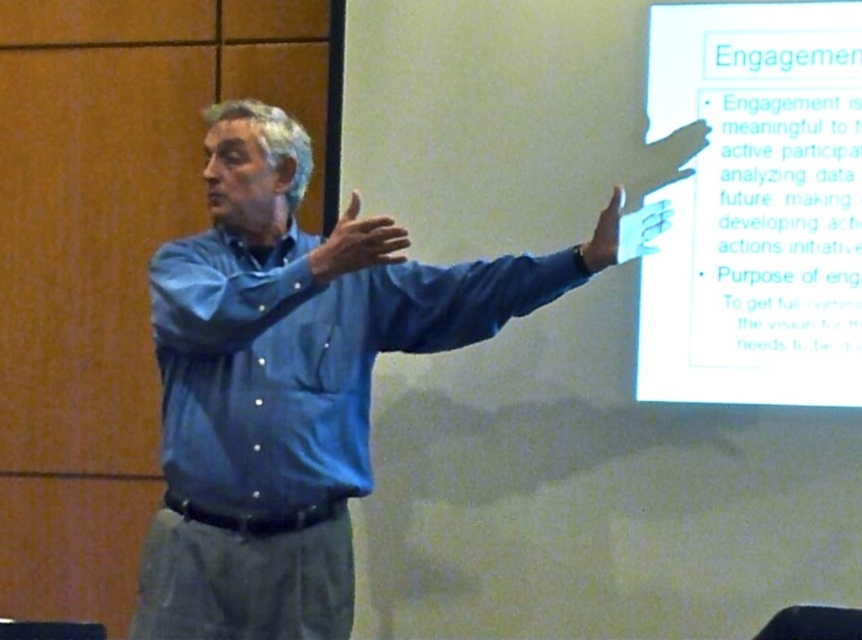
Question: Which point appears closest to the camera in this image?

Choices:
 (A) (179, 282)
 (B) (760, 22)
 (C) (326, 280)
 (D) (615, 192)

Answer: (C)

Question: Which object is positioned farthest from the blue button-up shirt at center?

Choices:
 (A) matte blue shirt at center
 (B) blue button-down shirt at center
 (C) matte blue shirt at upper right
 (D) white paper at upper right

Answer: (D)

Question: Is matte blue shirt at center positioned at the back of matte blue shirt at upper right?

Choices:
 (A) no
 (B) yes

Answer: (A)

Question: Among these objects, which one is farthest from the camera?

Choices:
 (A) blue button-down shirt at center
 (B) matte blue shirt at upper right
 (C) blue button-up shirt at center

Answer: (B)

Question: Can you confirm if blue button-up shirt at center is positioned above matte blue shirt at upper right?

Choices:
 (A) yes
 (B) no

Answer: (B)

Question: Can you confirm if white paper at upper right is wider than blue button-up shirt at center?

Choices:
 (A) yes
 (B) no

Answer: (B)